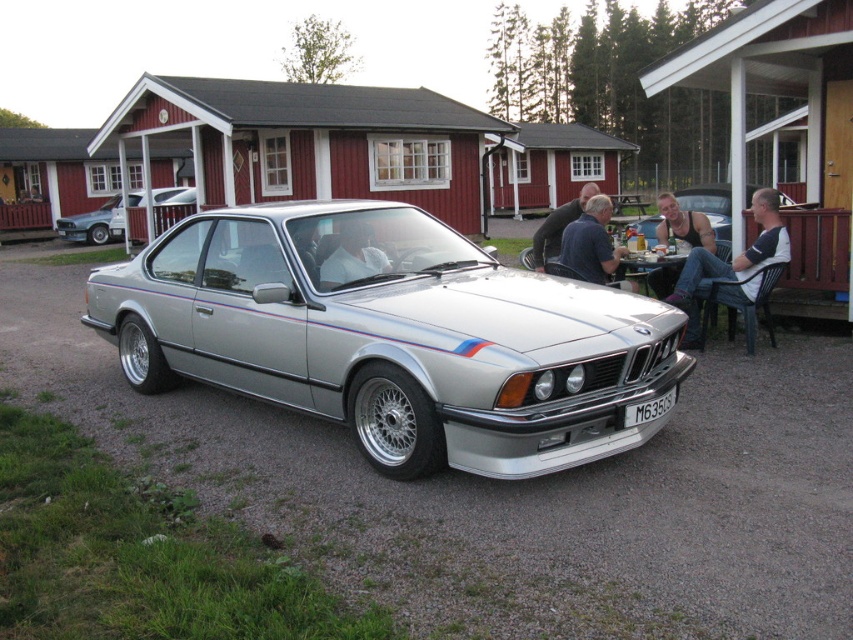
Is silver metallic car at upper left behind dark blue shirt at center?

Yes, it is behind dark blue shirt at center.

Can you confirm if silver metallic car at upper left is wider than dark blue shirt at center?

In fact, silver metallic car at upper left might be narrower than dark blue shirt at center.

Between point (78, 241) and point (552, 246), which one is positioned in front?

Point (552, 246) is in front.

Where is `silver metallic car at upper left`? silver metallic car at upper left is located at coordinates (93, 224).

Is dark blue shirt at center positioned in front of black plastic license plate at center?

No, it is not.

Between dark blue shirt at center and black plastic license plate at center, which one has more height?

dark blue shirt at center is taller.

Locate an element on the screen. The height and width of the screenshot is (640, 853). dark blue shirt at center is located at coordinates (558, 227).

This screenshot has width=853, height=640. In order to click on dark blue shirt at center in this screenshot , I will do `click(558, 227)`.

Between dark blue shirt at center and wooden picnic table at center, which one has less height?

wooden picnic table at center is shorter.

Does point (572, 212) come in front of point (650, 280)?

That is False.

Where is `dark blue shirt at center`? The height and width of the screenshot is (640, 853). dark blue shirt at center is located at coordinates [x=558, y=227].